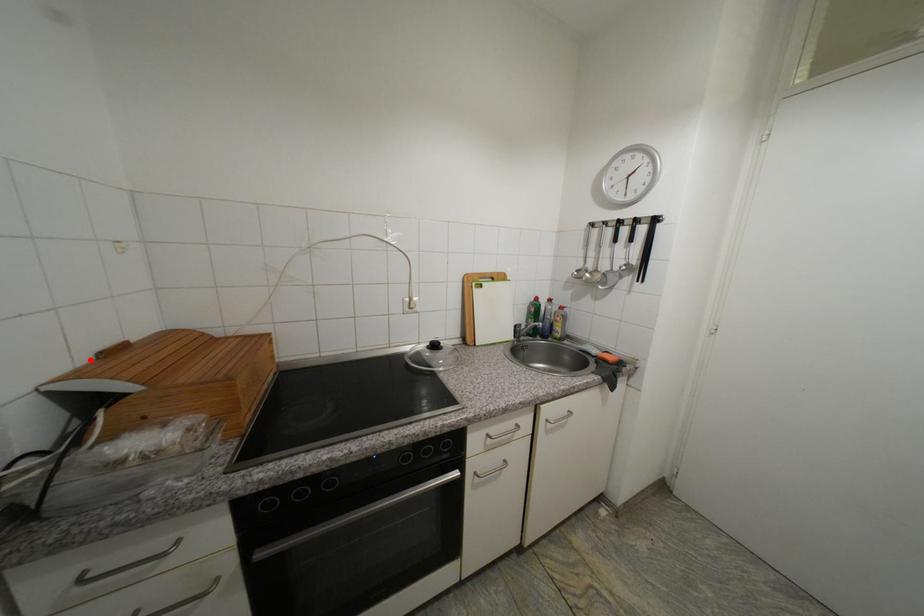
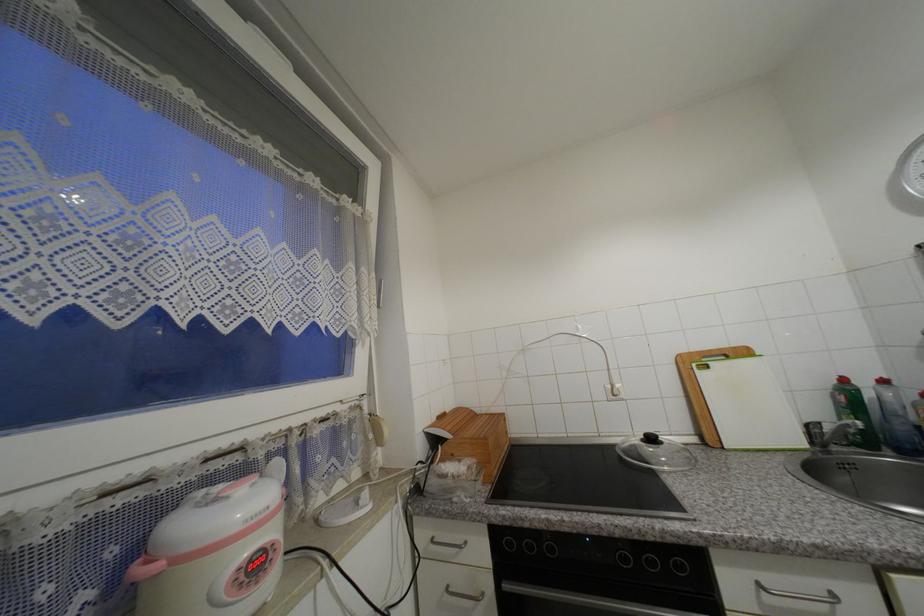
Find the pixel in the second image that matches the highlighted location in the first image.

(440, 419)